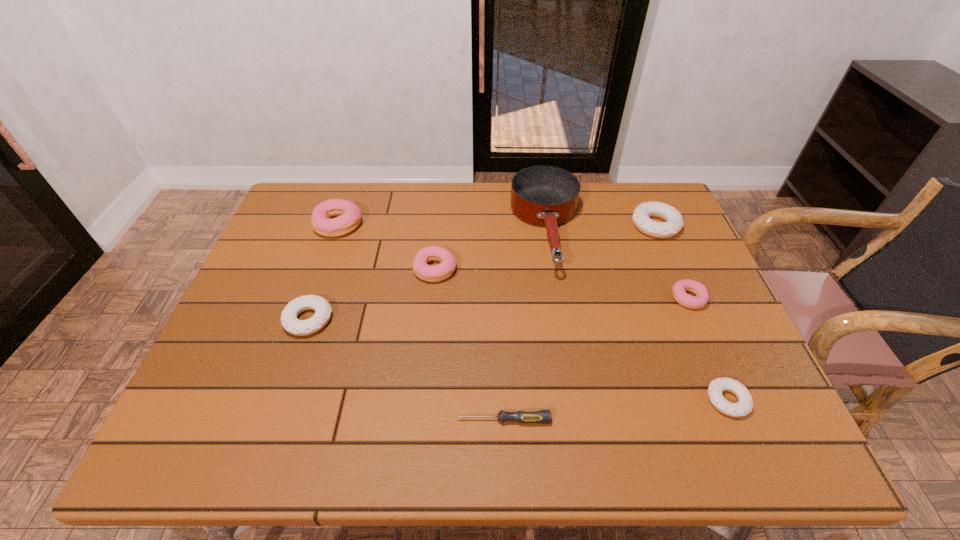
This screenshot has height=540, width=960. In order to click on vacant space that satisfies the following two spatial constraints: 1. on the front side of the smallest pink doughnut; 2. on the right side of the second biggest pink doughnut in this screenshot , I will do `click(432, 299)`.

Locate an element on the screen. Image resolution: width=960 pixels, height=540 pixels. free region that satisfies the following two spatial constraints: 1. on the front side of the nearest white doughnut; 2. insert the screwdriver into a screw head is located at coordinates (736, 420).